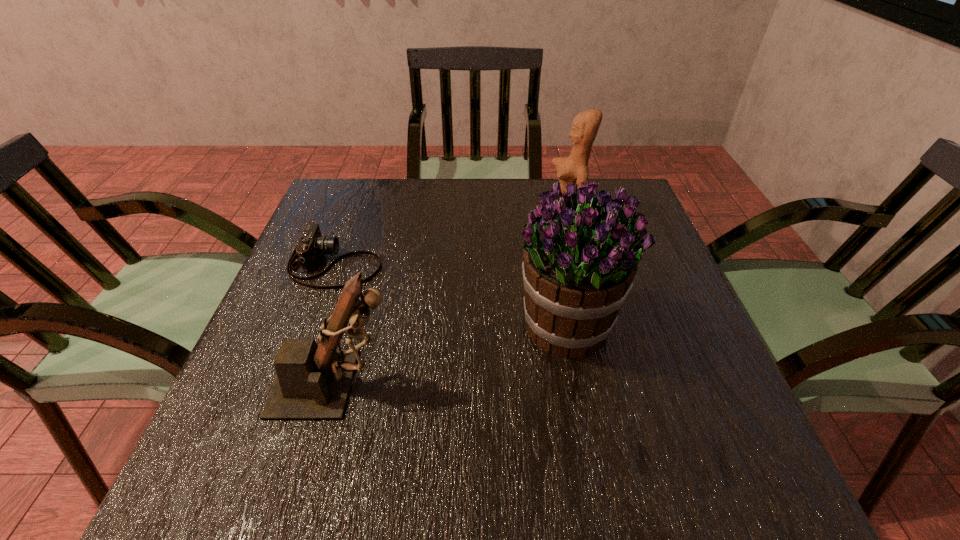
Image resolution: width=960 pixels, height=540 pixels. Find the location of `free space located 0.390m on the front-facing side of the shortest object`. free space located 0.390m on the front-facing side of the shortest object is located at coordinates (546, 263).

You are a GUI agent. You are given a task and a screenshot of the screen. Output one action in this format:
    pyautogui.click(x=<x>, y=<y>)
    Task: Click on the object located in the far edge section of the desktop
    
    Given the screenshot: What is the action you would take?
    pyautogui.click(x=574, y=169)

Where is `figurine situated at the left edge`? The image size is (960, 540). figurine situated at the left edge is located at coordinates (313, 382).

This screenshot has width=960, height=540. Find the location of `camera positioned at the left edge`. camera positioned at the left edge is located at coordinates (311, 245).

I want to click on bouquet present at the right edge, so click(x=580, y=258).

Locate an element on the screen. This screenshot has height=540, width=960. figurine present at the right edge is located at coordinates (574, 169).

Locate an element on the screen. The height and width of the screenshot is (540, 960). object present at the far right corner is located at coordinates (574, 169).

Find the location of a particular element. The width and height of the screenshot is (960, 540). free space at the far edge of the desktop is located at coordinates (475, 198).

At what (x,y) coordinates should I click in order to perform the action: click on free space at the near edge of the desktop. Please return your answer as a coordinate pair (x, y). This screenshot has width=960, height=540. Looking at the image, I should click on (556, 450).

In order to click on vacant space at the left edge in this screenshot , I will do `click(297, 441)`.